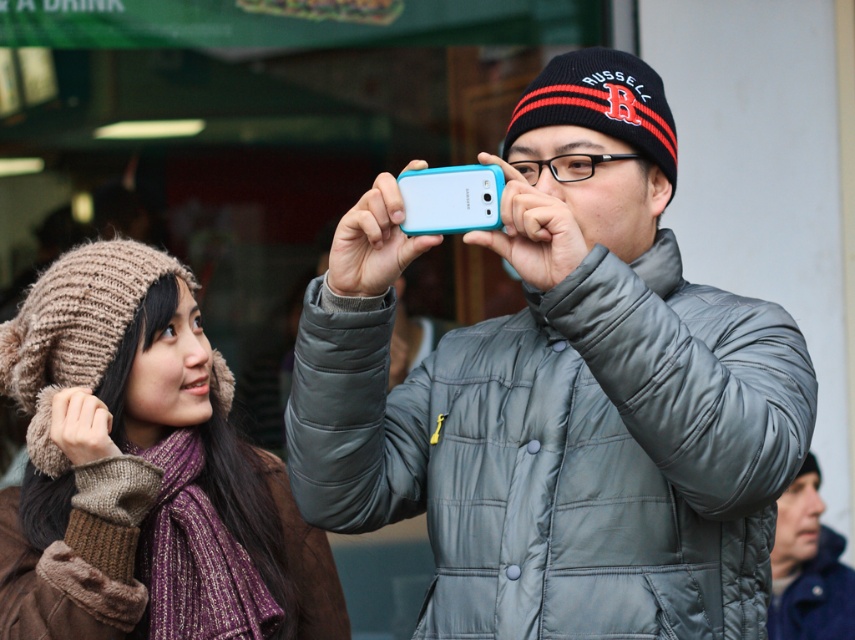
You are a photographer trying to position two points in a photo. You have two points marked at coordinates point (805, 502) and point (488, 202). Which point is closer to the camera?

Point (805, 502) is further to the viewer than point (488, 202), so the point closer to the camera is point (488, 202).

Based on the photo, you are standing in front of the two people in the image. You want to place a sticker exactly at the point marked by the coordinates point (561, 394). Which object should you place the sticker on?

The point (561, 394) is on the teal matte phone at center, so you should place the sticker on the teal matte phone at center.

You are a photographer trying to capture a closeup shot of the teal matte phone at center and the knitted woolen hat at upper left in the scene. Which object should you zoom in on first if you want to focus on the taller one?

The teal matte phone at center is taller than the knitted woolen hat at upper left, so you should zoom in on the teal matte phone at center first.